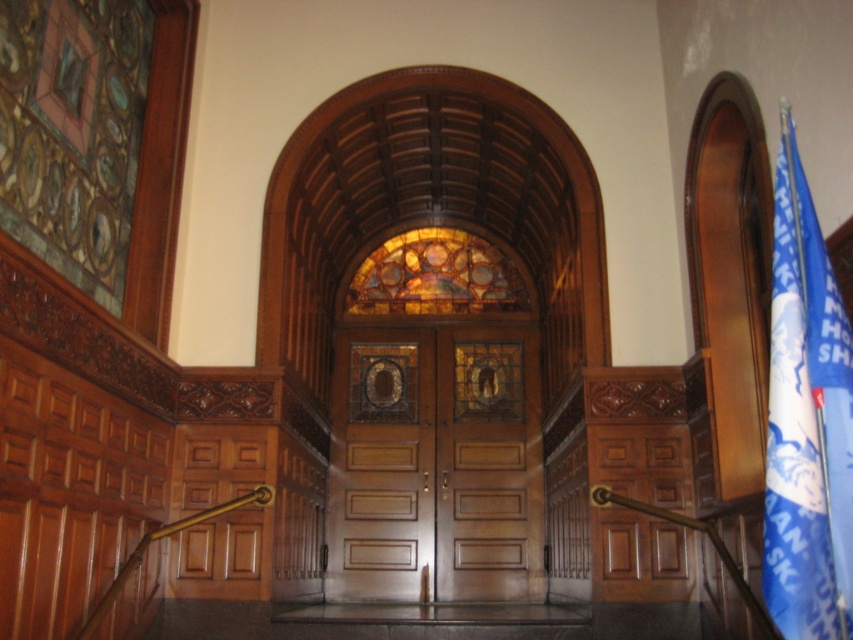
Can you confirm if wooden door at center is positioned below blue fabric flag at right?

Yes.

Does point (474, 344) lie in front of point (825, 548)?

That is False.

I want to click on wooden door at center, so click(x=434, y=465).

Is wooden door at center smaller than stained glass window at center?

Yes.

Based on the photo, which is above, wooden door at center or stained glass window at center?

stained glass window at center

Does point (376, 544) come closer to viewer compared to point (492, 285)?

Yes, point (376, 544) is in front of point (492, 285).

Find the location of `wooden door at center`. wooden door at center is located at coordinates (434, 465).

Between blue fabric flag at right and stained glass window at center, which one is positioned lower?

Positioned lower is blue fabric flag at right.

Is point (769, 602) positioned in front of point (438, 275)?

Yes, point (769, 602) is in front of point (438, 275).

Is point (827, 472) closer to camera compared to point (408, 272)?

Yes, it is.

Image resolution: width=853 pixels, height=640 pixels. I want to click on blue fabric flag at right, so click(805, 422).